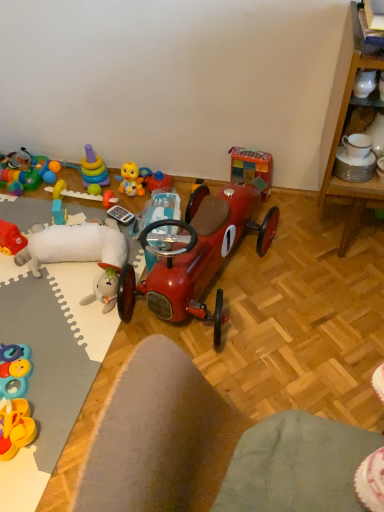
The width and height of the screenshot is (384, 512). Find the location of `vacant space in front of shiny metallic car at center, the 9th toy positioned from the left`. vacant space in front of shiny metallic car at center, the 9th toy positioned from the left is located at coordinates (130, 261).